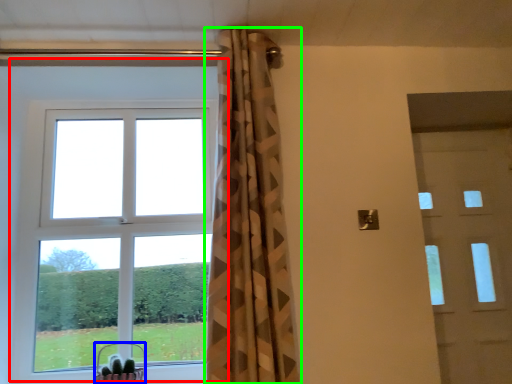
Question: Estimate the real-world distances between objects in this image. Which object is farther from window (highlighted by a red box), basket (highlighted by a blue box) or curtain (highlighted by a green box)?

Choices:
 (A) basket
 (B) curtain

Answer: (B)